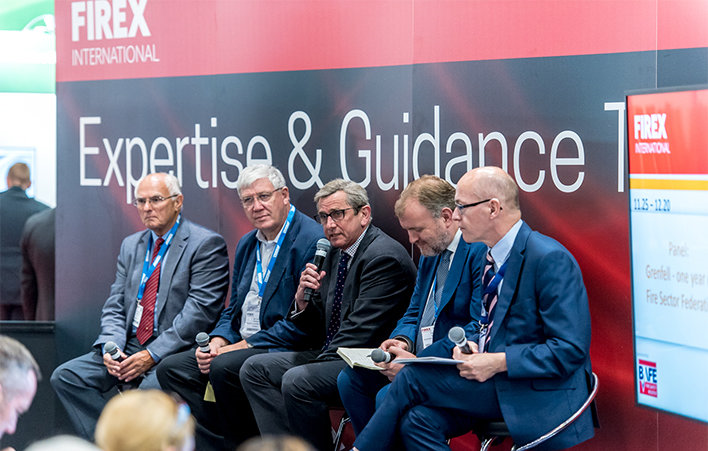
Locate an element on the screen. The image size is (708, 451). pink wall is located at coordinates (212, 32).